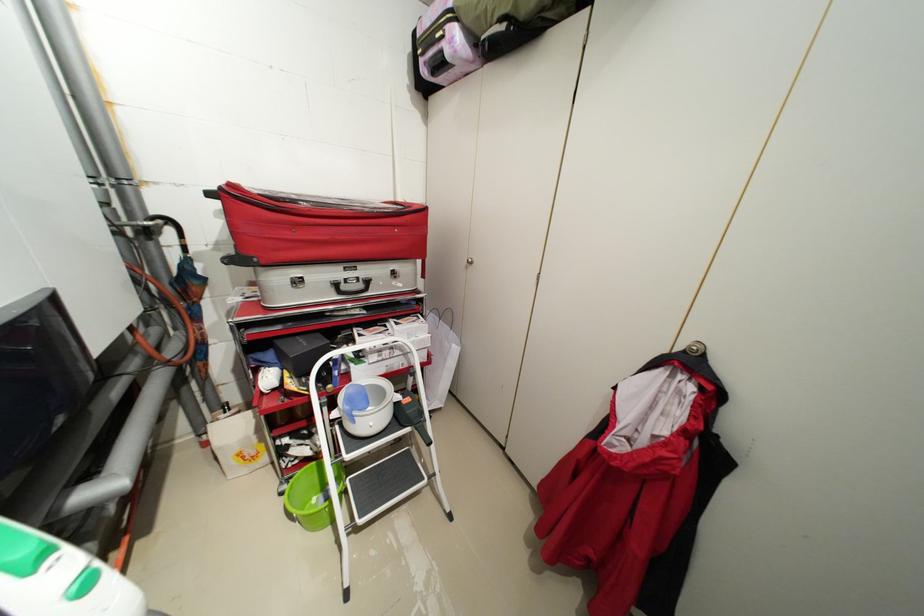
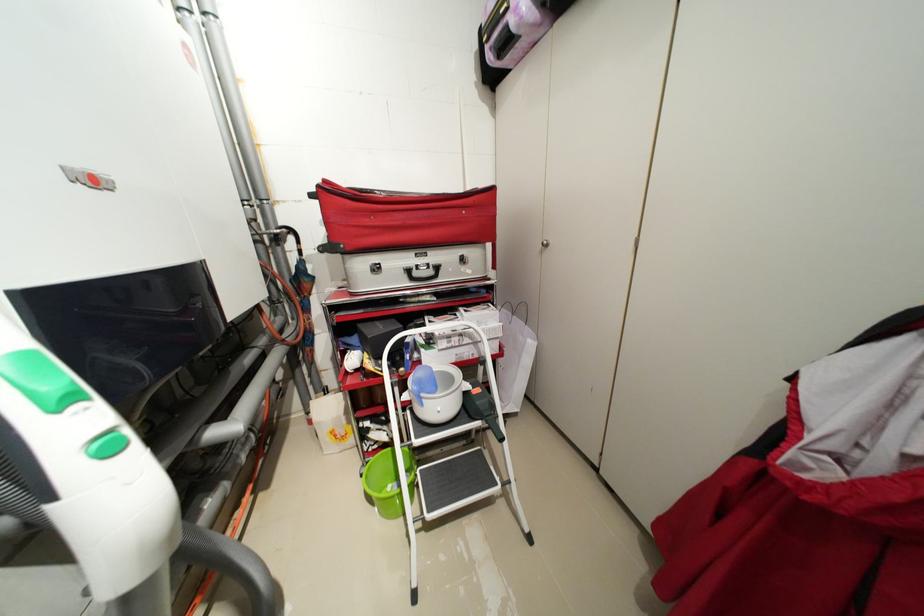
In the second image, find the point that corresponds to pixel 432 360 in the first image.

(505, 352)